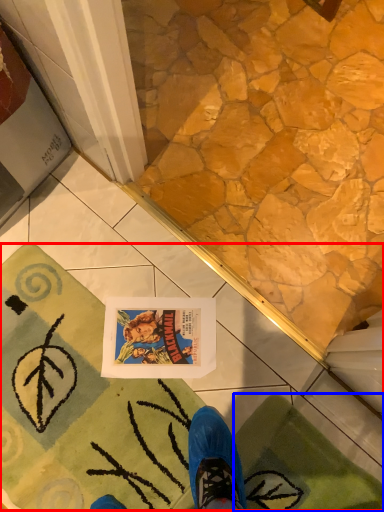
Question: Which object appears farthest to the camera in this image, bath mat (highlighted by a red box) or bath mat (highlighted by a blue box)?

Choices:
 (A) bath mat
 (B) bath mat

Answer: (A)